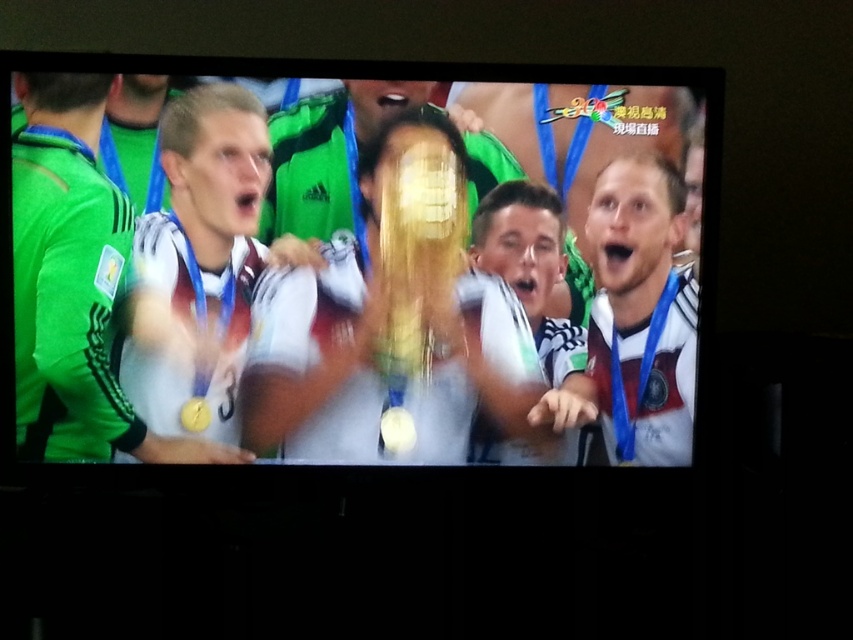
You are a photographer at a soccer event and need to capture a photo of both the shiny silver trophy at center and the matte gold medal at center. Based on their positions, which object should you focus on first to ensure both are in the frame?

The shiny silver trophy at center is located below the matte gold medal at center, so you should focus on the matte gold medal at center first to ensure both are in the frame.

You are a photographer trying to capture a closeup shot of both the matte gold medal at center and the white matte jersey at center. Your camera can only focus on objects within 12 inches of each other. Can you take the photo without moving either object?

The matte gold medal at center and white matte jersey at center are 13.75 inches apart from each other. Since the camera requires objects to be within 12 inches of each other for focus, the distance is too great. You cannot take the photo without moving them closer.

You are a photographer standing in front of the television screen. You want to capture a closeup of the shiny silver trophy at center. According to the coordinates provided, where should you aim your camera to ensure the trophy is centered in your shot?

You should aim your camera at the coordinates point (329, 326) to center the shiny silver trophy at center in your shot.